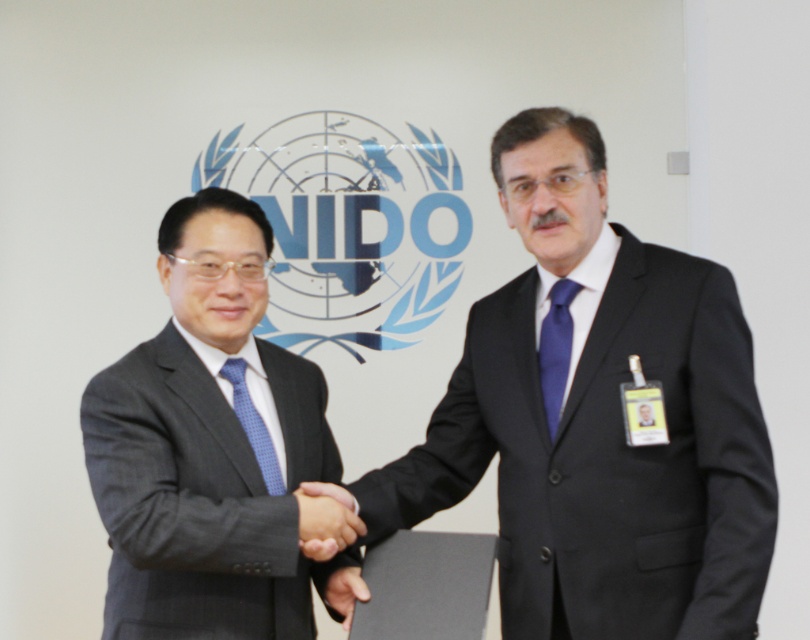
Question: Which object appears closest to the camera in this image?

Choices:
 (A) matte black hand at center
 (B) blue dotted tie at center

Answer: (A)

Question: Based on their relative distances, which object is farther from the black leather hand at center?

Choices:
 (A) matte black suit at left
 (B) matte black hand at center
 (C) matte blue tie at right

Answer: (C)

Question: Can you confirm if black suit at center is wider than black leather hand at center?

Choices:
 (A) yes
 (B) no

Answer: (A)

Question: Does black suit at center lie behind matte black hand at center?

Choices:
 (A) yes
 (B) no

Answer: (B)

Question: Which of the following is the farthest from the observer?

Choices:
 (A) black leather hand at center
 (B) matte blue tie at right
 (C) matte black hand at center
 (D) blue dotted tie at center

Answer: (D)

Question: Is matte black suit at left bigger than matte black hand at center?

Choices:
 (A) no
 (B) yes

Answer: (B)